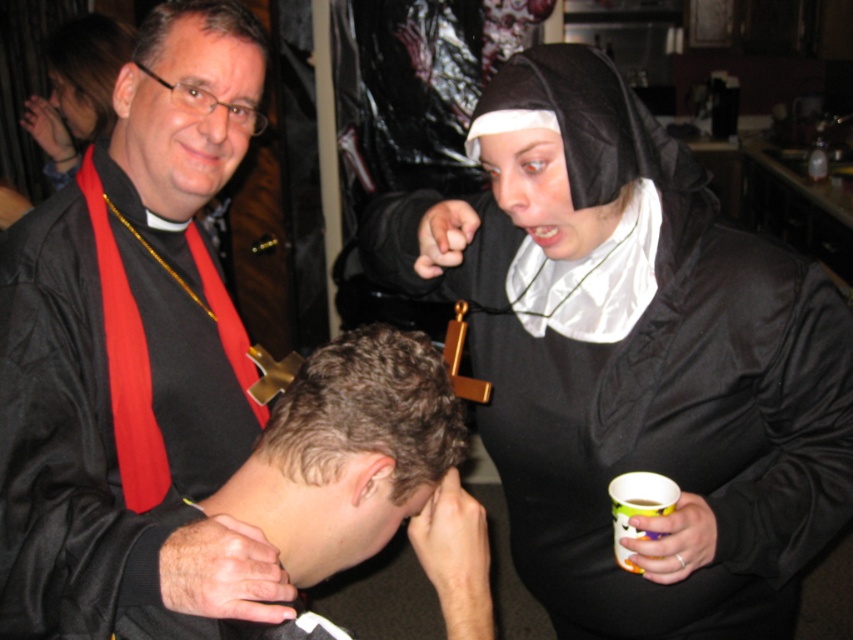
This screenshot has height=640, width=853. Describe the element at coordinates (186, 109) in the screenshot. I see `matte black head at upper left` at that location.

Who is more distant from viewer, (142, 147) or (573, 65)?

Positioned behind is point (142, 147).

Locate an element on the screen. This screenshot has width=853, height=640. matte black head at upper left is located at coordinates [x=186, y=109].

Between black satin nun at upper right and matte black nun's habit at upper right, which one is positioned lower?

black satin nun at upper right

Image resolution: width=853 pixels, height=640 pixels. Find the location of `black satin nun at upper right`. black satin nun at upper right is located at coordinates (633, 356).

Identify the location of black satin nun at upper right. (633, 356).

Does point (315, 397) lie in front of point (614, 93)?

Yes, point (315, 397) is in front of point (614, 93).

Is black satin robe at center closer to camera compared to black matte nun's habit at upper right?

Yes, it is in front of black matte nun's habit at upper right.

Describe the element at coordinates (368, 472) in the screenshot. Image resolution: width=853 pixels, height=640 pixels. I see `black satin robe at center` at that location.

At what (x,y) coordinates should I click in order to perform the action: click on black satin robe at center. Please return your answer as a coordinate pair (x, y). The height and width of the screenshot is (640, 853). Looking at the image, I should click on (368, 472).